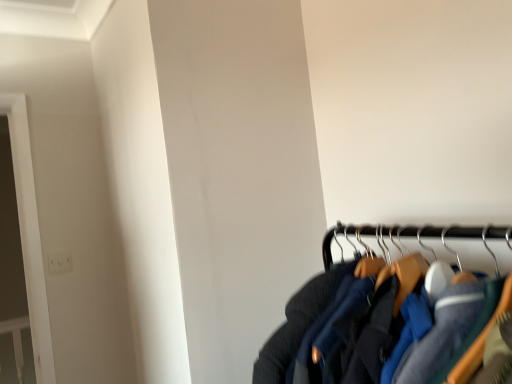
Question: Considering their positions, is dark blue fabric jacket at lower right located in front of or behind white plastic electric outlet at upper left?

Choices:
 (A) behind
 (B) front

Answer: (B)

Question: From a real-world perspective, is dark blue fabric jacket at lower right positioned above or below white plastic electric outlet at upper left?

Choices:
 (A) above
 (B) below

Answer: (B)

Question: In terms of height, does dark blue fabric jacket at lower right look taller or shorter compared to white plastic electric outlet at upper left?

Choices:
 (A) short
 (B) tall

Answer: (B)

Question: In the image, is white plastic electric outlet at upper left positioned in front of or behind dark blue fabric jacket at lower right?

Choices:
 (A) front
 (B) behind

Answer: (B)

Question: Is point (47, 256) closer or farther from the camera than point (298, 299)?

Choices:
 (A) farther
 (B) closer

Answer: (A)

Question: In terms of width, does white plastic electric outlet at upper left look wider or thinner when compared to dark blue fabric jacket at lower right?

Choices:
 (A) wide
 (B) thin

Answer: (B)

Question: From a real-world perspective, is white plastic electric outlet at upper left above or below dark blue fabric jacket at lower right?

Choices:
 (A) above
 (B) below

Answer: (A)